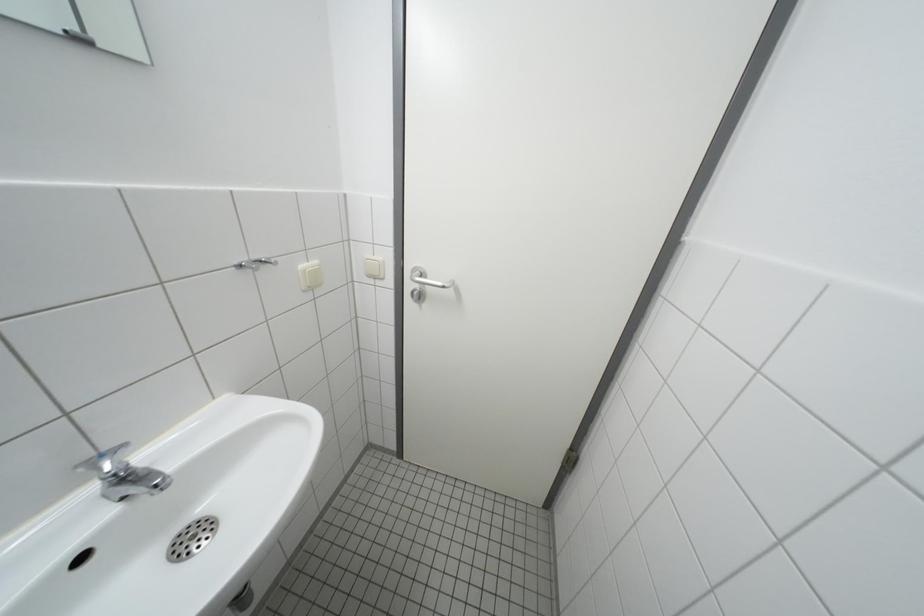
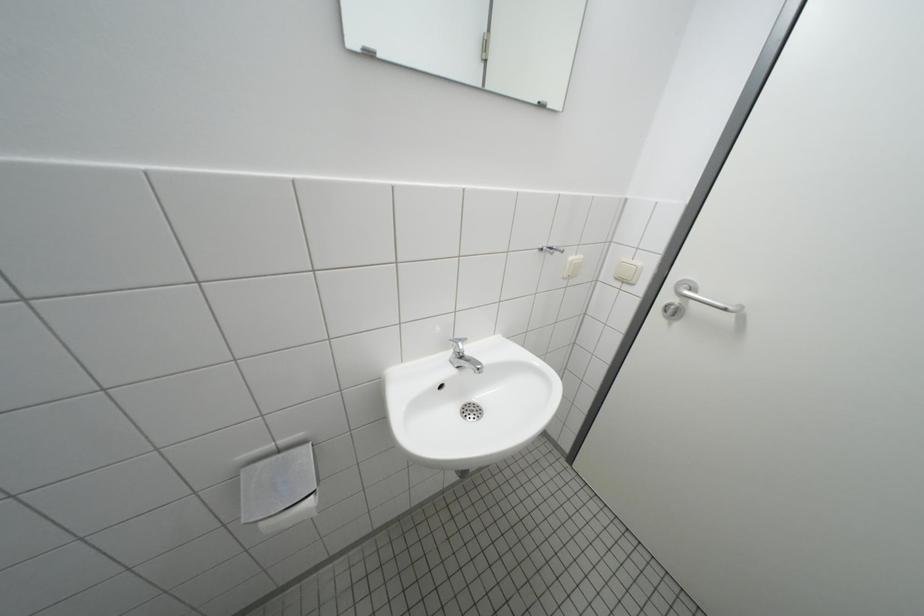
Question: The camera is either moving clockwise (left) or counter-clockwise (right) around the object. The first image is from the beginning of the video and the second image is from the end. Is the camera moving left or right when shooting the video?

Choices:
 (A) Left
 (B) Right

Answer: (B)